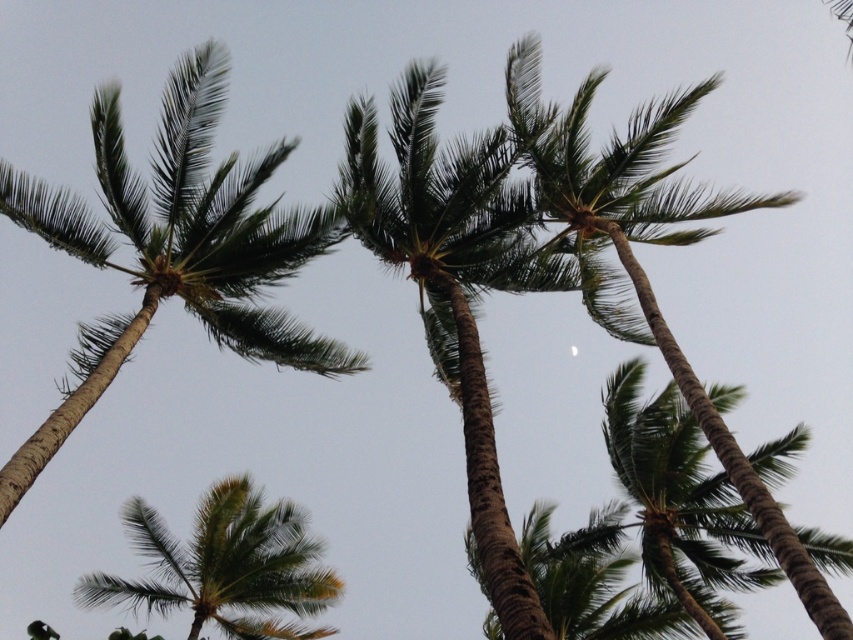
Can you confirm if green leafy coconut tree at upper left is smaller than green textured palm tree at upper right?

No, green leafy coconut tree at upper left is not smaller than green textured palm tree at upper right.

Does green leafy coconut tree at upper left appear under green textured palm tree at upper right?

No, green leafy coconut tree at upper left is not below green textured palm tree at upper right.

At what (x,y) coordinates should I click in order to perform the action: click on green leafy coconut tree at upper left. Please return your answer as a coordinate pair (x, y). The width and height of the screenshot is (853, 640). Looking at the image, I should click on (173, 248).

Who is lower down, green leafy palm tree at center or green textured palm tree at upper right?

Positioned lower is green textured palm tree at upper right.

Can you confirm if green leafy palm tree at center is positioned above green textured palm tree at upper right?

Correct, green leafy palm tree at center is located above green textured palm tree at upper right.

Find the location of a particular element. The height and width of the screenshot is (640, 853). green leafy palm tree at center is located at coordinates (639, 262).

Which is in front, point (312, 364) or point (242, 522)?

Positioned in front is point (312, 364).

Which is above, green leafy coconut tree at upper left or green leafy palm tree at lower left?

green leafy coconut tree at upper left is higher up.

Which is behind, point (55, 227) or point (302, 589)?

The point (302, 589) is behind.

Locate an element on the screen. green leafy coconut tree at upper left is located at coordinates (173, 248).